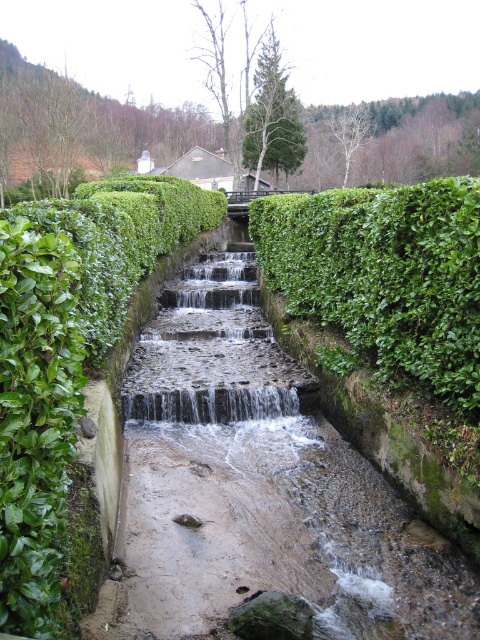
You are a gardener who needs to trim both hedges. Starting from the green leafy hedge at upper center, which direction should you walk to reach the green leafy hedge at center?

Since the green leafy hedge at upper center is to the right of the green leafy hedge at center, you should walk to the left to reach the green leafy hedge at center.

You are standing at the edge of the water channel and want to reach a specific point marked at coordinates point (447,186). If your maximum comfortable walking distance is 5 meters, can you comfortably walk to that point without needing to swim?

The distance of point (447,186) from viewer is 5.04 meters, so it is slightly beyond your maximum comfortable walking distance of 5 meters. You might need to swim or find a closer point.

You are standing at the edge of the water channel and want to locate two specific points marked in the scene. The first point is at coordinate point(464, 310) and the second is at point(190, 403). Which of these two points is nearer to your current position?

Point(464, 310) is closer to the camera than point(190, 403), so the first point is nearer to your current position.